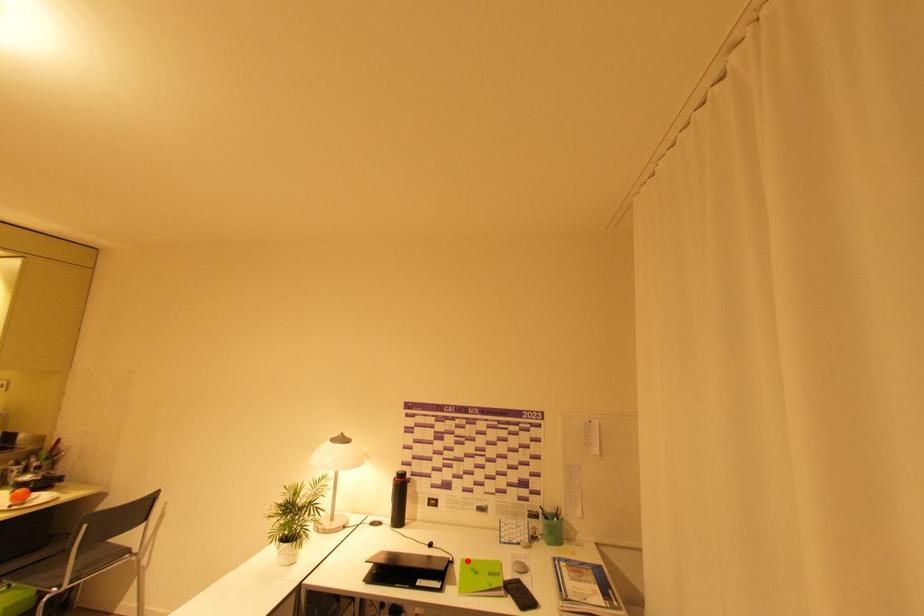
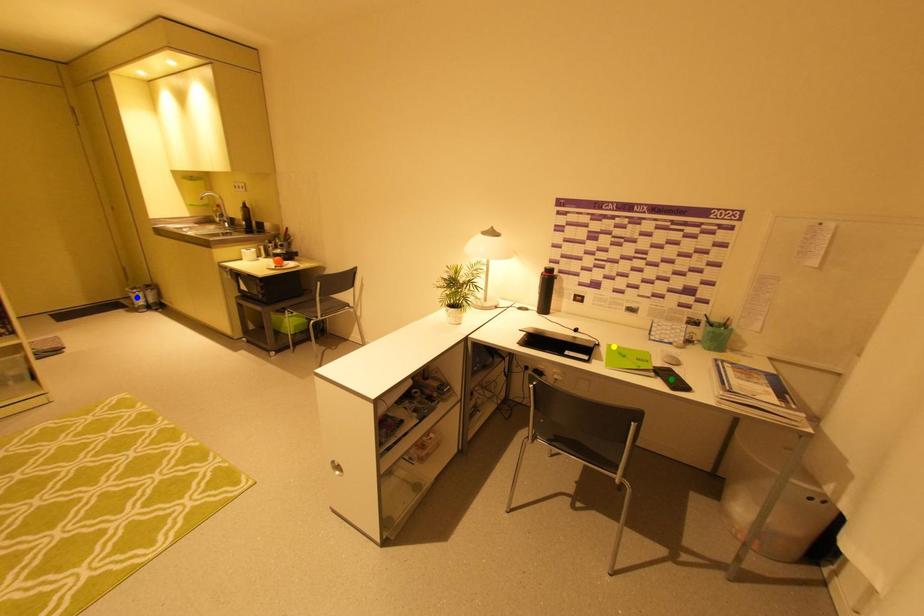
Question: I am providing you with two images of the same scene from different viewpoints. A red point is marked on the first image. You are given multiple points on the second image. Which point in image 2 represents the same 3d spot as the red point in image 1?

Choices:
 (A) blue point
 (B) yellow point
 (C) green point

Answer: (B)